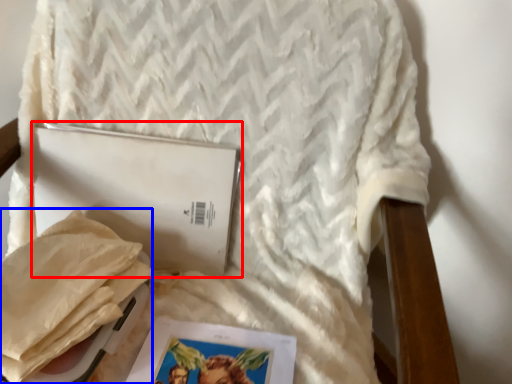
Question: Among these objects, which one is nearest to the camera, journal (highlighted by a red box) or material (highlighted by a blue box)?

Choices:
 (A) journal
 (B) material

Answer: (B)